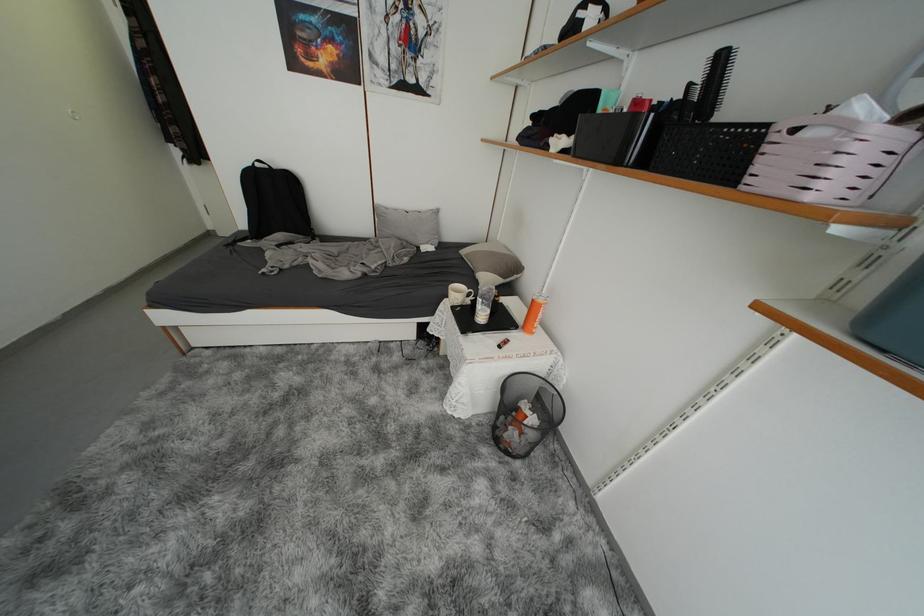
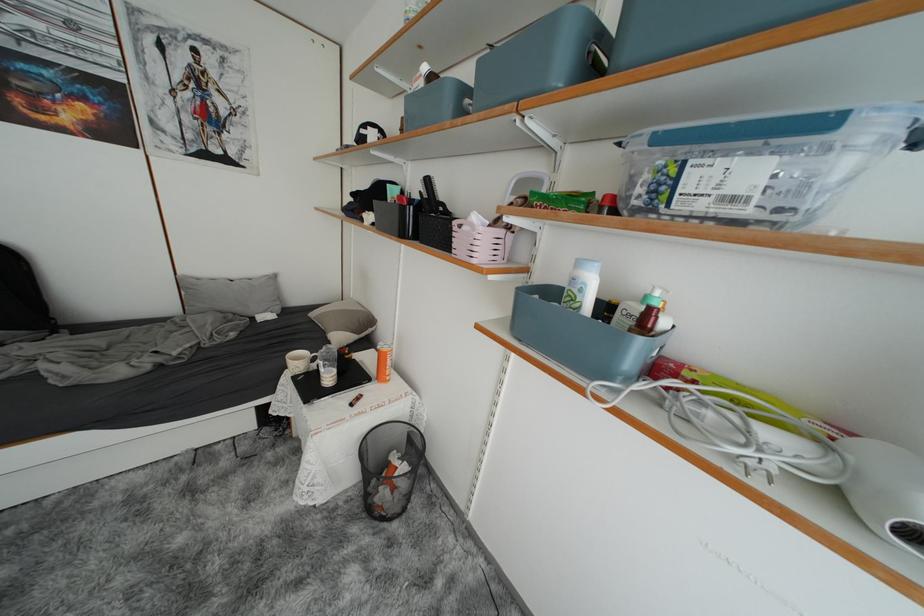
Find the pixel in the second image that matches point 415,213 in the first image.

(238, 281)